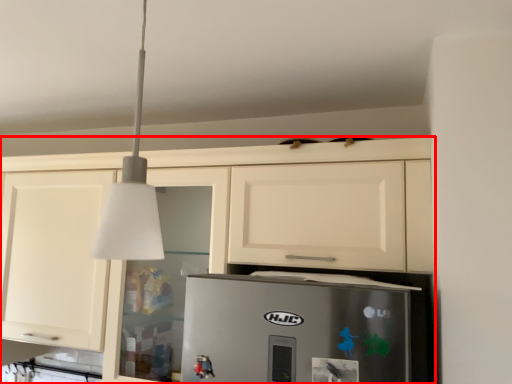
Question: From the image's perspective, where is cabinetry (annotated by the red box) located in relation to light fixture in the image?

Choices:
 (A) above
 (B) below

Answer: (B)